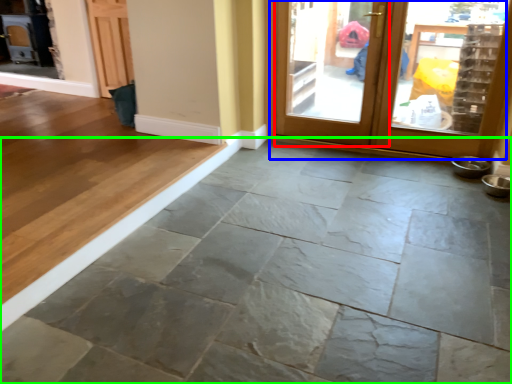
Question: Based on their relative distances, which object is farther from screen door (highlighted by a red box)? Choose from door (highlighted by a blue box) and concrete (highlighted by a green box).

Choices:
 (A) door
 (B) concrete

Answer: (B)